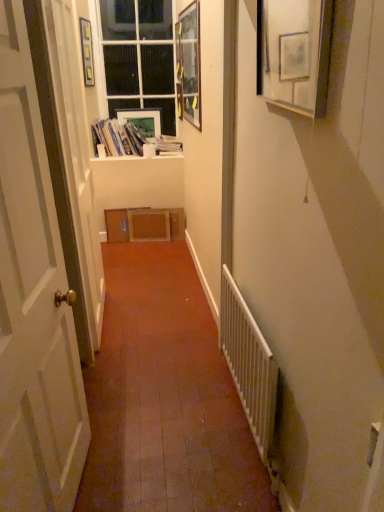
Question: Does white wood window sill at upper center appear on the left side of wooden picture frame at upper center, positioned as the 3th picture frame in left-to-right order?

Choices:
 (A) yes
 (B) no

Answer: (A)

Question: From a real-world perspective, is white wood window sill at upper center over wooden picture frame at upper center, which appears as the 3th picture frame when viewed from the back?

Choices:
 (A) no
 (B) yes

Answer: (A)

Question: From the image's perspective, is white wood window sill at upper center on top of wooden picture frame at upper center, which appears as the 3th picture frame when viewed from the back?

Choices:
 (A) no
 (B) yes

Answer: (A)

Question: Does white wood window sill at upper center have a smaller size compared to wooden picture frame at upper center, which appears as the 3th picture frame when viewed from the back?

Choices:
 (A) no
 (B) yes

Answer: (B)

Question: Does white wood window sill at upper center have a larger size compared to wooden picture frame at upper center, positioned as the 3th picture frame in left-to-right order?

Choices:
 (A) yes
 (B) no

Answer: (B)

Question: Is wooden picture frame at upper center, positioned as the 3th picture frame in left-to-right order, located within white wood window sill at upper center?

Choices:
 (A) no
 (B) yes

Answer: (A)

Question: Does white metal radiator at lower right have a lesser width compared to white glass window at upper center?

Choices:
 (A) no
 (B) yes

Answer: (B)

Question: Is the position of white metal radiator at lower right less distant than that of white glass window at upper center?

Choices:
 (A) yes
 (B) no

Answer: (A)

Question: Considering the relative sizes of white metal radiator at lower right and white glass window at upper center in the image provided, is white metal radiator at lower right smaller than white glass window at upper center?

Choices:
 (A) yes
 (B) no

Answer: (A)

Question: Is white metal radiator at lower right positioned beyond the bounds of white glass window at upper center?

Choices:
 (A) yes
 (B) no

Answer: (A)

Question: Can you confirm if white metal radiator at lower right is taller than white glass window at upper center?

Choices:
 (A) no
 (B) yes

Answer: (A)

Question: From a real-world perspective, is white metal radiator at lower right on top of white glass window at upper center?

Choices:
 (A) yes
 (B) no

Answer: (B)

Question: Is white glossy door at left completely or partially outside of wooden picture frame at upper right, arranged as the first picture frame when viewed from the front?

Choices:
 (A) yes
 (B) no

Answer: (A)